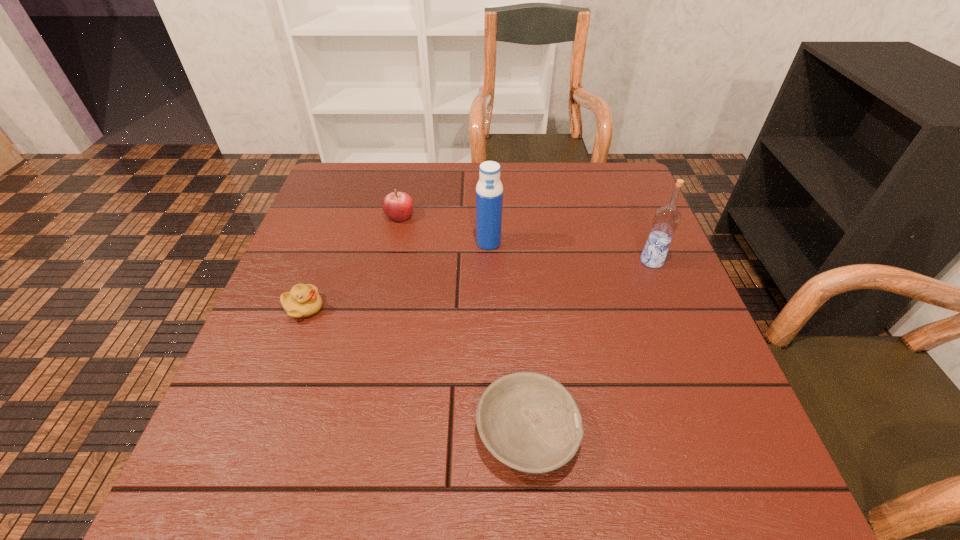
This screenshot has height=540, width=960. What are the coordinates of `the third farthest object` in the screenshot? It's located at (666, 220).

You are a GUI agent. You are given a task and a screenshot of the screen. Output one action in this format:
    pyautogui.click(x=<x>, y=<y>)
    Task: Click on the rightmost object
    The width and height of the screenshot is (960, 540).
    Given the screenshot: What is the action you would take?
    pyautogui.click(x=666, y=220)

Locate an element on the screen. This screenshot has height=540, width=960. water bottle is located at coordinates (489, 191).

At what (x,y) coordinates should I click in order to perform the action: click on the second object from left to right. Please return your answer as a coordinate pair (x, y). Image resolution: width=960 pixels, height=540 pixels. Looking at the image, I should click on (398, 206).

Where is `apple`? This screenshot has width=960, height=540. apple is located at coordinates (398, 206).

Find the location of a particular element. the leftmost object is located at coordinates (303, 300).

This screenshot has height=540, width=960. What are the coordinates of `the fourth farthest object` in the screenshot? It's located at (303, 300).

The image size is (960, 540). Identify the location of the shortest object. click(x=530, y=422).

Where is `the nearest object`? the nearest object is located at coordinates (530, 422).

The height and width of the screenshot is (540, 960). I want to click on free space located on the front of the rightmost object, so click(x=662, y=288).